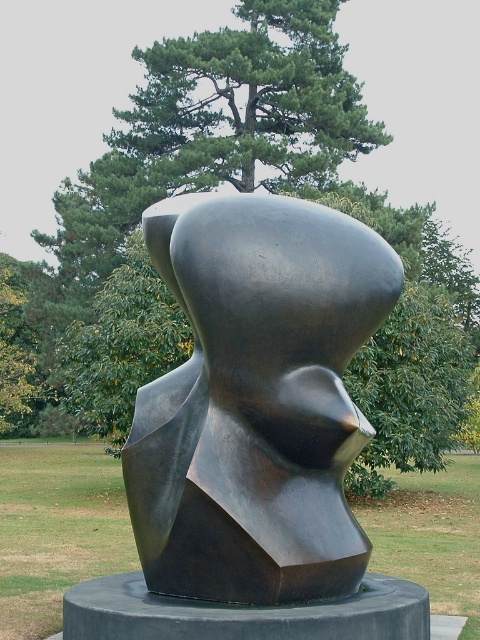
Question: Can you confirm if polished bronze bust at center is smaller than green leafy tree at upper center?

Choices:
 (A) no
 (B) yes

Answer: (B)

Question: Which object appears farthest from the camera in this image?

Choices:
 (A) green leafy tree at upper center
 (B) polished bronze bust at center

Answer: (A)

Question: Where is polished bronze bust at center located in relation to green leafy tree at upper center in the image?

Choices:
 (A) left
 (B) right

Answer: (A)

Question: Is polished bronze bust at center further to the viewer compared to green leafy tree at upper center?

Choices:
 (A) yes
 (B) no

Answer: (B)